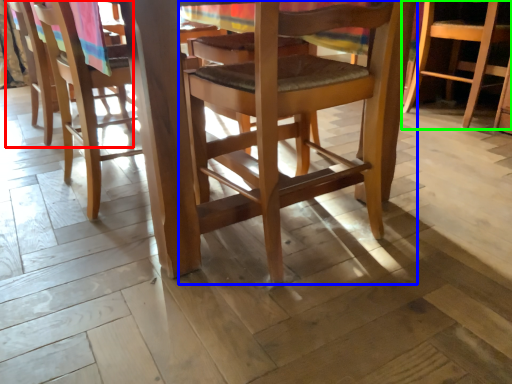
Question: Considering the real-world distances, which object is farthest from chair (highlighted by a red box)? chair (highlighted by a blue box) or chair (highlighted by a green box)?

Choices:
 (A) chair
 (B) chair

Answer: (B)